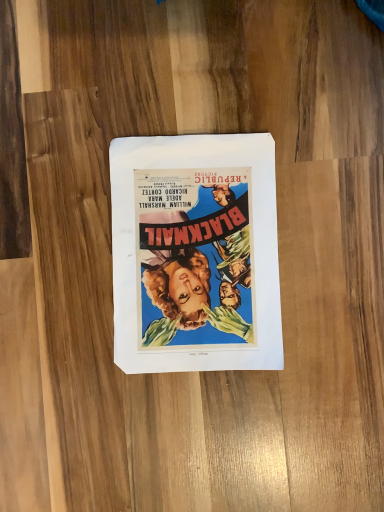
You are a GUI agent. You are given a task and a screenshot of the screen. Output one action in this format:
    pyautogui.click(x=<x>, y=<y>)
    Task: Click on the free spot above matte paper poster at center (from a real-world perspective)
    The image size is (384, 512).
    Given the screenshot: What is the action you would take?
    pyautogui.click(x=195, y=252)